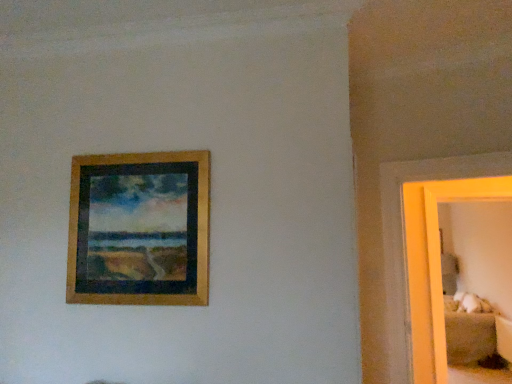
What do you see at coordinates (139, 229) in the screenshot? I see `wooden frame at upper left` at bounding box center [139, 229].

Where is `wooden frame at upper left`? This screenshot has width=512, height=384. wooden frame at upper left is located at coordinates (139, 229).

This screenshot has width=512, height=384. In order to click on wooden frame at upper left in this screenshot , I will do `click(139, 229)`.